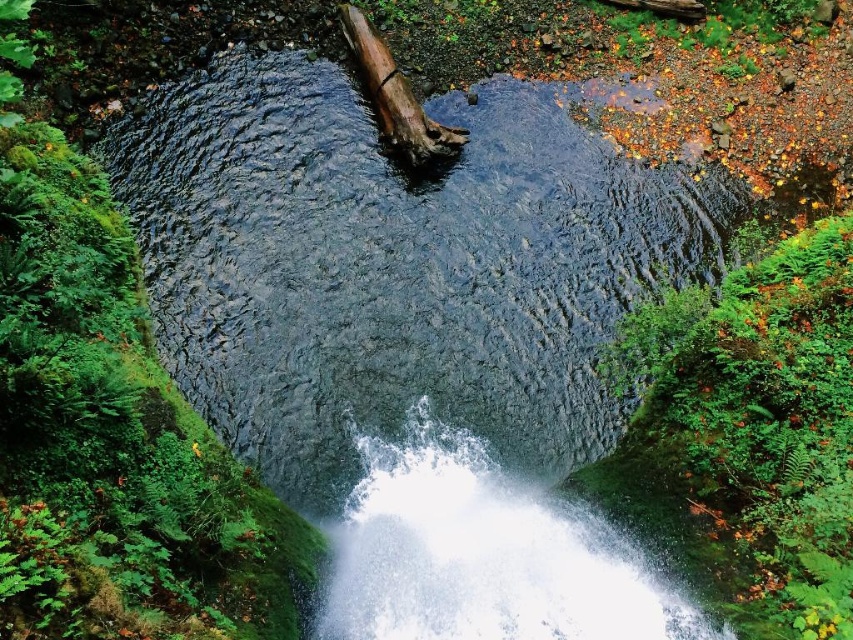
Question: Does white frothy water at center lie behind brown rough log at center?

Choices:
 (A) yes
 (B) no

Answer: (B)

Question: Does white frothy water at center have a larger size compared to brown rough log at center?

Choices:
 (A) yes
 (B) no

Answer: (A)

Question: Does white frothy water at center have a larger size compared to brown rough log at center?

Choices:
 (A) yes
 (B) no

Answer: (A)

Question: Among these objects, which one is nearest to the camera?

Choices:
 (A) brown rough log at center
 (B) white frothy water at center

Answer: (B)